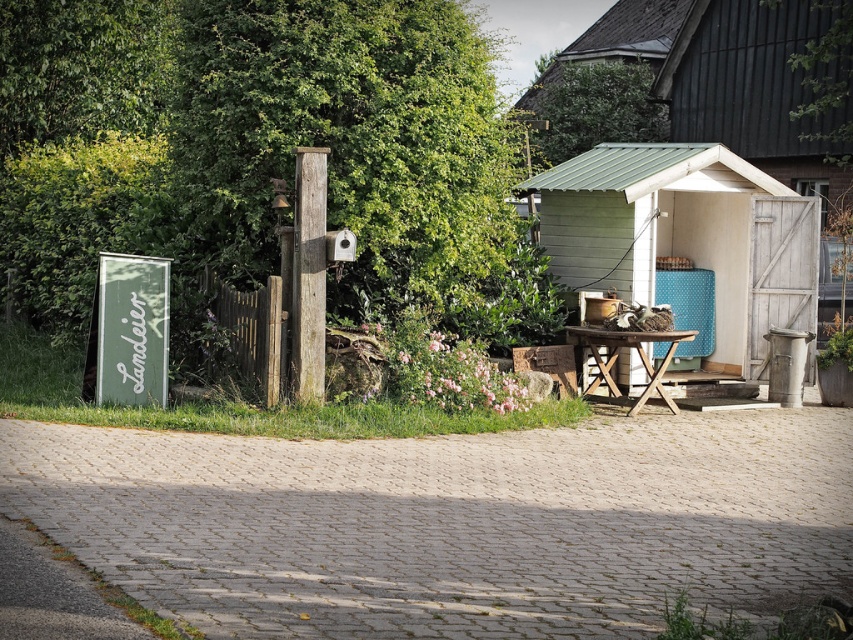
Which of these two, white wood shed at center or weathered wood post at center, stands taller?

white wood shed at center is taller.

Which is more to the left, white wood shed at center or weathered wood post at center?

From the viewer's perspective, weathered wood post at center appears more on the left side.

Image resolution: width=853 pixels, height=640 pixels. What do you see at coordinates (686, 236) in the screenshot? I see `white wood shed at center` at bounding box center [686, 236].

The height and width of the screenshot is (640, 853). What are the coordinates of `white wood shed at center` in the screenshot? It's located at (686, 236).

Is point (381, 282) farther from camera compared to point (631, 97)?

That is False.

At what (x,y) coordinates should I click in order to perform the action: click on green leafy tree at upper left. Please return your answer as a coordinate pair (x, y). The width and height of the screenshot is (853, 640). Looking at the image, I should click on [x=349, y=141].

Is green leafy tree at upper center taller than wooden post at center?

Correct, green leafy tree at upper center is much taller as wooden post at center.

Image resolution: width=853 pixels, height=640 pixels. I want to click on green leafy tree at upper center, so click(592, 109).